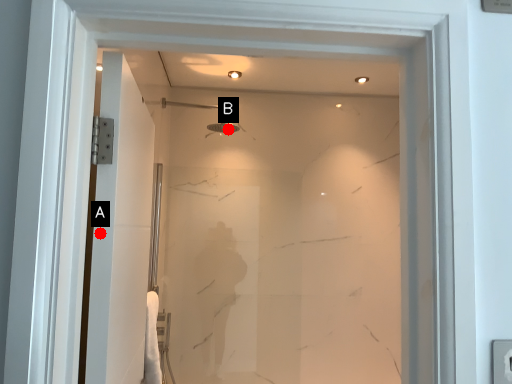
Question: Two points are circled on the image, labeled by A and B beside each circle. Which point is further to the camera?

Choices:
 (A) A is further
 (B) B is further

Answer: (B)